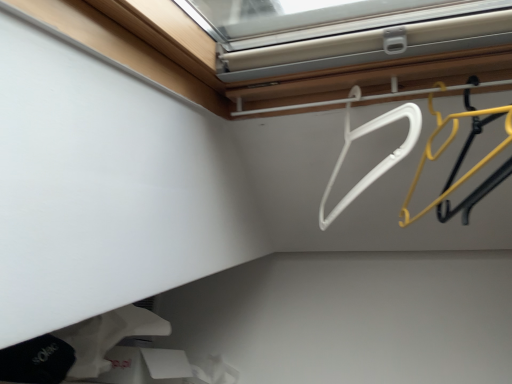
Question: Considering the positions of white plastic hanger at upper center, the first hanger positioned from the left, and yellow plastic hanger at upper right, the second hanger from the left, in the image, is white plastic hanger at upper center, the first hanger positioned from the left, bigger or smaller than yellow plastic hanger at upper right, the second hanger from the left,?

Choices:
 (A) small
 (B) big

Answer: (B)

Question: From a real-world perspective, relative to yellow plastic hanger at upper right, the second hanger from the left, is white plastic hanger at upper center, the second hanger when ordered from right to left, vertically above or below?

Choices:
 (A) above
 (B) below

Answer: (A)

Question: Which is nearer to the white matte socks at lower left?

Choices:
 (A) white plastic hanger at upper center, the first hanger positioned from the left
 (B) yellow plastic hanger at upper right, which is the 1th hanger in right-to-left order

Answer: (A)

Question: Based on their relative distances, which object is farther from the yellow plastic hanger at upper right, which is the 1th hanger in right-to-left order?

Choices:
 (A) white matte socks at lower left
 (B) white plastic hanger at upper center, the second hanger when ordered from right to left

Answer: (A)